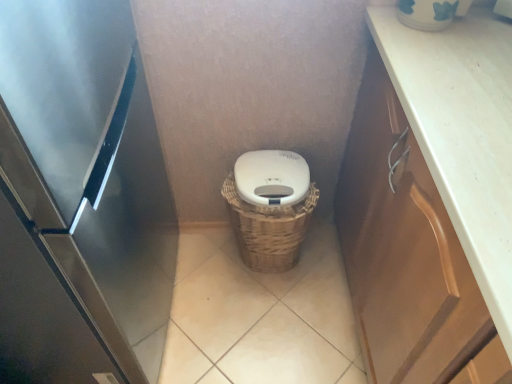
Locate an element on the screen. free space above white matte lid at center (from a real-world perspective) is located at coordinates (273, 168).